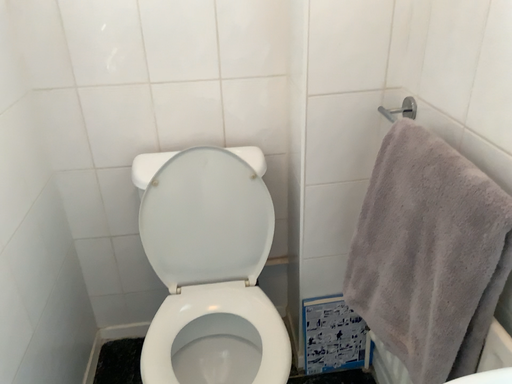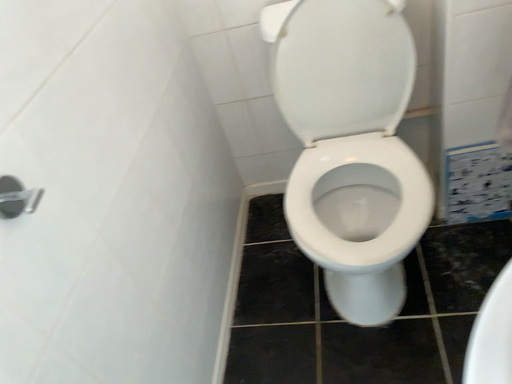
Question: Which way did the camera rotate in the video?

Choices:
 (A) rotated left
 (B) rotated right

Answer: (A)